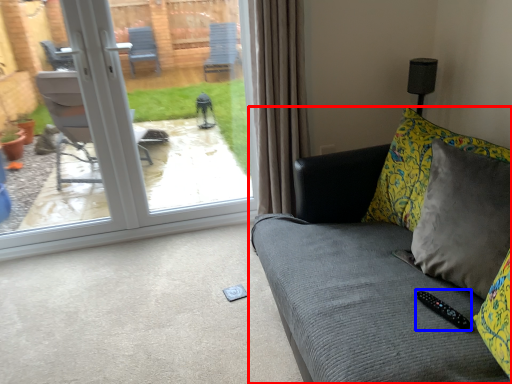
Question: Which object appears closest to the camera in this image, studio couch (highlighted by a red box) or remote (highlighted by a blue box)?

Choices:
 (A) studio couch
 (B) remote

Answer: (A)